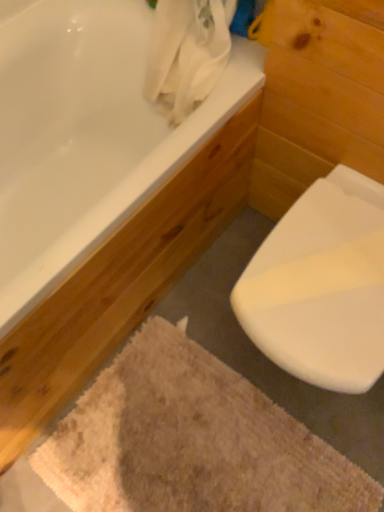
Where is `white glossy toilet at lower right`? This screenshot has height=512, width=384. white glossy toilet at lower right is located at coordinates (321, 286).

From the image's perspective, is white glossy bathtub at upper left located above beige textured bath mat at lower center?

Indeed, from the image's perspective, white glossy bathtub at upper left is shown above beige textured bath mat at lower center.

From a real-world perspective, between white glossy bathtub at upper left and beige textured bath mat at lower center, who is vertically lower?

beige textured bath mat at lower center, from a real-world perspective.

Is white glossy bathtub at upper left closer to camera compared to beige textured bath mat at lower center?

Yes, the depth of white glossy bathtub at upper left is less than that of beige textured bath mat at lower center.

Based on their sizes in the image, would you say white glossy bathtub at upper left is bigger or smaller than beige textured bath mat at lower center?

white glossy bathtub at upper left is bigger than beige textured bath mat at lower center.

Is beige textured bath mat at lower center taller or shorter than white glossy bathtub at upper left?

beige textured bath mat at lower center is shorter than white glossy bathtub at upper left.

Is beige textured bath mat at lower center inside or outside of white glossy bathtub at upper left?

beige textured bath mat at lower center is located beyond the bounds of white glossy bathtub at upper left.

Between point (271, 462) and point (27, 90), which one is positioned behind?

The point (27, 90) is behind.

Considering the positions of objects beige textured bath mat at lower center and white glossy bathtub at upper left in the image provided, who is more to the right, beige textured bath mat at lower center or white glossy bathtub at upper left?

From the viewer's perspective, beige textured bath mat at lower center appears more on the right side.

Who is taller, white glossy toilet at lower right or white glossy bathtub at upper left?

white glossy bathtub at upper left.

Is white glossy toilet at lower right inside or outside of white glossy bathtub at upper left?

white glossy toilet at lower right lies outside white glossy bathtub at upper left.

This screenshot has height=512, width=384. Find the location of `bathtub above the white glossy toilet at lower right (from the image's perspective)`. bathtub above the white glossy toilet at lower right (from the image's perspective) is located at coordinates (86, 135).

Considering the relative positions of white glossy toilet at lower right and white glossy bathtub at upper left in the image provided, is white glossy toilet at lower right to the left or to the right of white glossy bathtub at upper left?

Based on their positions, white glossy toilet at lower right is located to the right of white glossy bathtub at upper left.

Looking at this image, considering the sizes of beige textured bath mat at lower center and white glossy toilet at lower right in the image, is beige textured bath mat at lower center wider or thinner than white glossy toilet at lower right?

Considering their sizes, beige textured bath mat at lower center looks broader than white glossy toilet at lower right.

Which object is positioned more to the right, beige textured bath mat at lower center or white glossy toilet at lower right?

white glossy toilet at lower right is more to the right.

Looking at this image, is beige textured bath mat at lower center not inside white glossy toilet at lower right?

beige textured bath mat at lower center is positioned outside white glossy toilet at lower right.

Which object is wider, white glossy bathtub at upper left or white glossy toilet at lower right?

white glossy bathtub at upper left.

Between white glossy bathtub at upper left and white glossy toilet at lower right, which one has smaller size?

With smaller size is white glossy toilet at lower right.

Is white glossy bathtub at upper left positioned far away from white glossy toilet at lower right?

No, there isn't a large distance between white glossy bathtub at upper left and white glossy toilet at lower right.

Can we say white glossy toilet at lower right lies outside beige textured bath mat at lower center?

That's correct, white glossy toilet at lower right is outside of beige textured bath mat at lower center.

Between white glossy toilet at lower right and beige textured bath mat at lower center, which one has more height?

Standing taller between the two is white glossy toilet at lower right.

Is white glossy toilet at lower right not close to beige textured bath mat at lower center?

They are positioned close to each other.

From a real-world perspective, which object rests below the other?

In real-world perspective, beige textured bath mat at lower center is lower.

Where is `bath mat behind the white glossy bathtub at upper left`? The image size is (384, 512). bath mat behind the white glossy bathtub at upper left is located at coordinates (191, 441).

Locate an element on the screen. bathtub that appears above the beige textured bath mat at lower center (from the image's perspective) is located at coordinates (86, 135).

When comparing their distances from white glossy bathtub at upper left, does white glossy toilet at lower right or beige textured bath mat at lower center seem closer?

Based on the image, white glossy toilet at lower right appears to be nearer to white glossy bathtub at upper left.

Looking at the image, which one is located closer to white glossy bathtub at upper left, beige textured bath mat at lower center or white glossy toilet at lower right?

white glossy toilet at lower right is closer to white glossy bathtub at upper left.

Which object lies further to the anchor point white glossy toilet at lower right, beige textured bath mat at lower center or white glossy bathtub at upper left?

white glossy bathtub at upper left is further to white glossy toilet at lower right.

Consider the image. When comparing their distances from beige textured bath mat at lower center, does white glossy toilet at lower right or white glossy bathtub at upper left seem closer?

white glossy toilet at lower right is closer to beige textured bath mat at lower center.

Based on the photo, looking at the image, which one is located further to white glossy toilet at lower right, white glossy bathtub at upper left or beige textured bath mat at lower center?

white glossy bathtub at upper left.

Looking at the image, which one is located closer to beige textured bath mat at lower center, white glossy bathtub at upper left or white glossy toilet at lower right?

The object closer to beige textured bath mat at lower center is white glossy toilet at lower right.

Locate an element on the screen. toilet that lies between white glossy bathtub at upper left and beige textured bath mat at lower center from top to bottom is located at coordinates (321, 286).